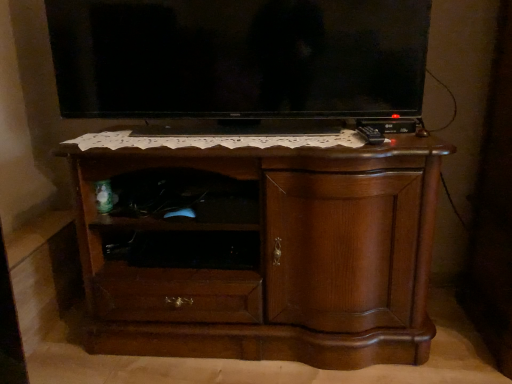
Question: Is brown wood chest of drawers at center beside black glossy tv at upper center?

Choices:
 (A) yes
 (B) no

Answer: (B)

Question: Does brown wood chest of drawers at center have a lesser width compared to black glossy tv at upper center?

Choices:
 (A) yes
 (B) no

Answer: (B)

Question: Is brown wood chest of drawers at center to the right of black glossy tv at upper center from the viewer's perspective?

Choices:
 (A) no
 (B) yes

Answer: (B)

Question: From the image's perspective, is brown wood chest of drawers at center below black glossy tv at upper center?

Choices:
 (A) no
 (B) yes

Answer: (B)

Question: From a real-world perspective, is brown wood chest of drawers at center over black glossy tv at upper center?

Choices:
 (A) yes
 (B) no

Answer: (B)

Question: Is black matte shelf at center spatially inside black glossy tv at upper center, or outside of it?

Choices:
 (A) inside
 (B) outside

Answer: (B)

Question: Based on their positions, is black matte shelf at center located to the left or right of black glossy tv at upper center?

Choices:
 (A) right
 (B) left

Answer: (B)

Question: Is black matte shelf at center in front of or behind black glossy tv at upper center in the image?

Choices:
 (A) behind
 (B) front

Answer: (A)

Question: Is black matte shelf at center taller or shorter than black glossy tv at upper center?

Choices:
 (A) short
 (B) tall

Answer: (A)

Question: From a real-world perspective, relative to black matte shelf at center, is brown wood chest of drawers at center vertically above or below?

Choices:
 (A) below
 (B) above

Answer: (B)

Question: In terms of height, does brown wood chest of drawers at center look taller or shorter compared to black matte shelf at center?

Choices:
 (A) tall
 (B) short

Answer: (A)

Question: From the image's perspective, relative to black matte shelf at center, is brown wood chest of drawers at center above or below?

Choices:
 (A) above
 (B) below

Answer: (A)

Question: Considering the positions of point (111, 263) and point (138, 264), is point (111, 263) closer or farther from the camera than point (138, 264)?

Choices:
 (A) closer
 (B) farther

Answer: (B)

Question: Is black glossy tv at upper center inside or outside of black matte shelf at center?

Choices:
 (A) outside
 (B) inside

Answer: (A)

Question: From a real-world perspective, relative to black matte shelf at center, is black glossy tv at upper center vertically above or below?

Choices:
 (A) above
 (B) below

Answer: (A)